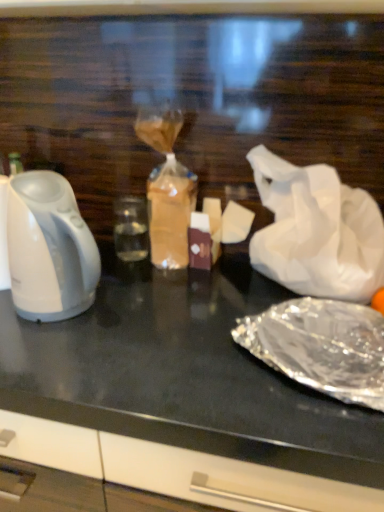
Where is `free location to the left of shiny metallic foil at lower right`? The width and height of the screenshot is (384, 512). free location to the left of shiny metallic foil at lower right is located at coordinates (171, 362).